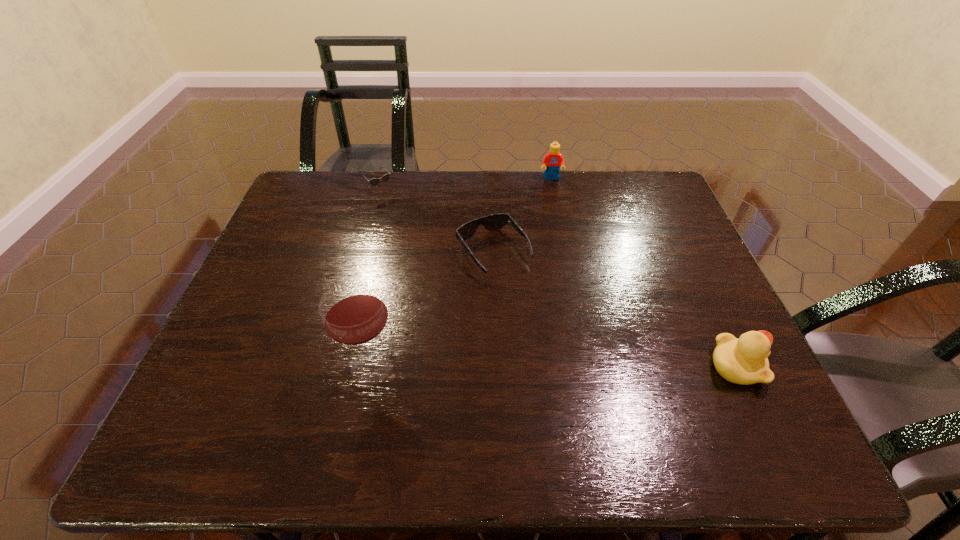
I want to click on vacant space situated on the front-facing side of the third nearest object, so click(x=561, y=343).

This screenshot has width=960, height=540. What are the coordinates of `blank space located on the front-facing side of the third nearest object` in the screenshot? It's located at (544, 321).

What are the coordinates of `vacant area situated 0.240m on the front-facing side of the third nearest object` in the screenshot? It's located at click(x=564, y=346).

Image resolution: width=960 pixels, height=540 pixels. In order to click on vacant space located 0.400m in front of the lenses of the left sunglasses in this screenshot , I will do `click(465, 280)`.

Locate an element on the screen. vacant space located 0.270m in front of the lenses of the left sunglasses is located at coordinates (439, 252).

Image resolution: width=960 pixels, height=540 pixels. Find the location of `free space located in front of the lenses of the left sunglasses`. free space located in front of the lenses of the left sunglasses is located at coordinates (463, 278).

In order to click on free spot located 0.390m on the face of the fourth object from left to right in this screenshot , I will do `click(565, 264)`.

At what (x,y) coordinates should I click in order to perform the action: click on vacant space situated 0.300m on the face of the fourth object from left to right. Please return your answer as a coordinate pair (x, y). Looking at the image, I should click on (562, 242).

This screenshot has height=540, width=960. In order to click on free point located on the face of the fourth object from left to right in this screenshot , I will do coord(561,233).

Where is `sunglasses at the far edge`? Image resolution: width=960 pixels, height=540 pixels. sunglasses at the far edge is located at coordinates (385, 178).